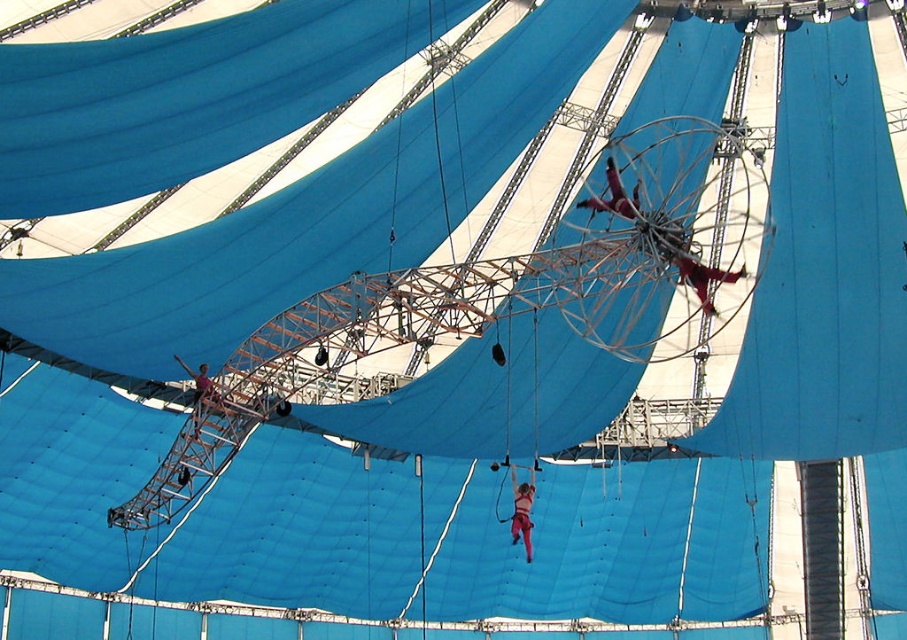
Question: Is metallic silver trapeze at upper center wider than metallic red trapeze artist at center?

Choices:
 (A) no
 (B) yes

Answer: (B)

Question: Which of the following is the farthest from the observer?

Choices:
 (A) metallic silver trapeze at upper center
 (B) metallic red trapeze artist at center
 (C) matte pink harness at center

Answer: (C)

Question: In this image, where is metallic silver trapeze at upper center located relative to metallic red trapeze artist at center?

Choices:
 (A) below
 (B) above

Answer: (A)

Question: Among these points, which one is nearest to the camera?

Choices:
 (A) (678, 253)
 (B) (532, 488)
 (C) (593, 205)

Answer: (A)

Question: Is metallic silver trapeze at upper center closer to camera compared to matte pink harness at center?

Choices:
 (A) no
 (B) yes

Answer: (B)

Question: Which object is closer to the camera taking this photo?

Choices:
 (A) metallic red trapeze artist at center
 (B) metallic silver trapeze at upper center
 (C) matte pink harness at center

Answer: (B)